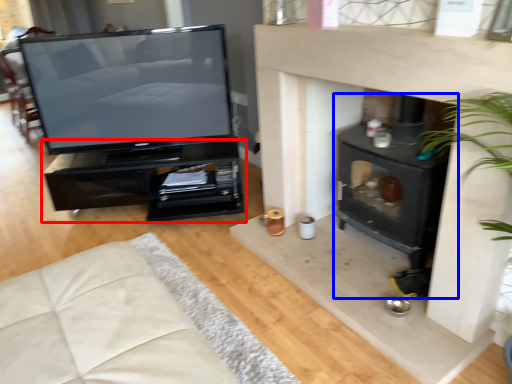
Question: Which object is closer to the camera taking this photo, furniture (highlighted by a red box) or wood burning stove (highlighted by a blue box)?

Choices:
 (A) furniture
 (B) wood burning stove

Answer: (B)